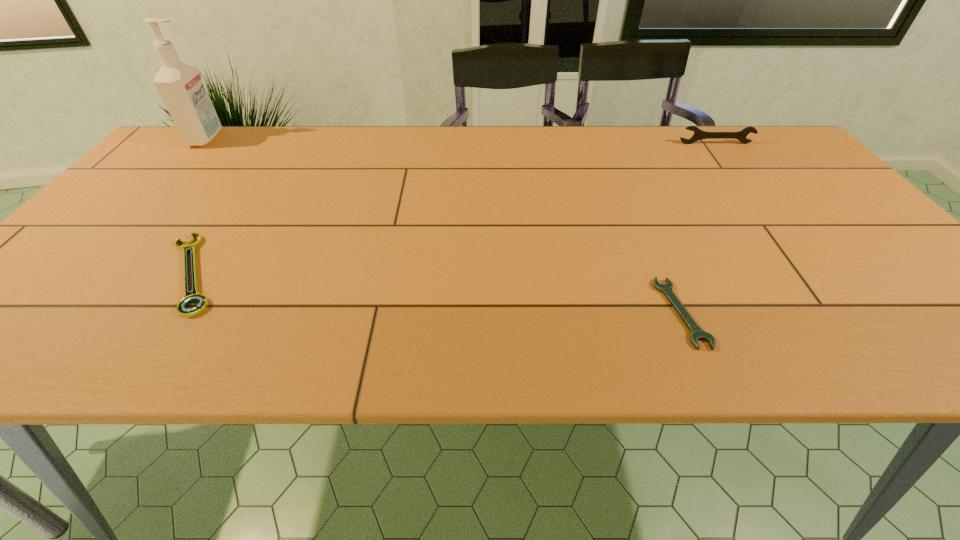
What are the coordinates of `the leftmost object` in the screenshot? It's located at (179, 84).

You are a GUI agent. You are given a task and a screenshot of the screen. Output one action in this format:
    pyautogui.click(x=<x>, y=<y>)
    Task: Click on the tallest object
    This screenshot has width=960, height=540.
    Given the screenshot: What is the action you would take?
    pyautogui.click(x=179, y=84)

You are a GUI agent. You are given a task and a screenshot of the screen. Output one action in this format:
    pyautogui.click(x=<x>, y=<y>)
    Task: Click on the farthest wrench
    
    Given the screenshot: What is the action you would take?
    pyautogui.click(x=698, y=134)

Find the location of a particular element. The width and height of the screenshot is (960, 540). the tallest wrench is located at coordinates (698, 134).

Where is `the second object from left to right`? The height and width of the screenshot is (540, 960). the second object from left to right is located at coordinates (192, 298).

Locate an element on the screen. the second object from right to left is located at coordinates (696, 333).

Where is `free space located 0.270m on the front label of the leftmost object`? The width and height of the screenshot is (960, 540). free space located 0.270m on the front label of the leftmost object is located at coordinates (311, 138).

You are a GUI agent. You are given a task and a screenshot of the screen. Output one action in this format:
    pyautogui.click(x=<x>, y=<y>)
    Task: Click on the free point located on the open ends of the rightmost wrench
    The width and height of the screenshot is (960, 540).
    Given the screenshot: What is the action you would take?
    pyautogui.click(x=740, y=176)

The image size is (960, 540). I want to click on free location located 0.200m on the back of the leftmost wrench, so click(x=250, y=186).

In order to click on vacant region located 0.390m on the right of the third object from left to right in this screenshot , I will do `click(906, 313)`.